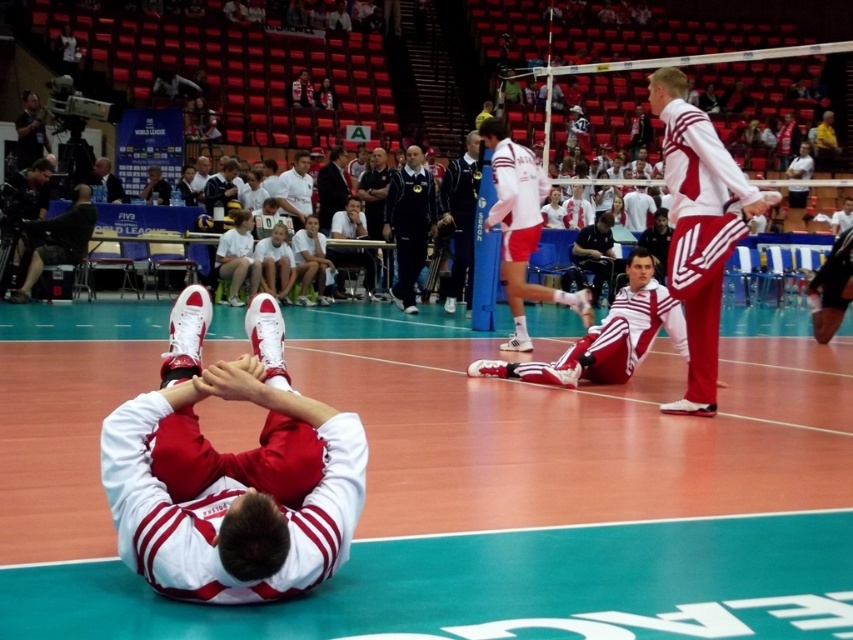
Question: Can you confirm if matte white sneakers at center is wider than matte black camera at upper left?

Choices:
 (A) yes
 (B) no

Answer: (A)

Question: Is matte white sneakers at center positioned before white matte shirt at center?

Choices:
 (A) no
 (B) yes

Answer: (B)

Question: Which of the following is the closest to the observer?

Choices:
 (A) (303, 198)
 (B) (706, 321)
 (C) (828, 554)
 (D) (33, 145)

Answer: (C)

Question: Based on their relative distances, which object is farther from the white matte tracksuit at upper right?

Choices:
 (A) green vinyl court at center
 (B) matte black camera at upper left
 (C) dark blue uniform at center

Answer: (B)

Question: Which object appears farthest from the camera in this image?

Choices:
 (A) dark blue uniform at center
 (B) dark blue smooth tracksuit at center
 (C) green vinyl court at center

Answer: (B)

Question: In this image, where is green vinyl court at center located relative to matte black camera at upper left?

Choices:
 (A) left
 (B) right

Answer: (B)